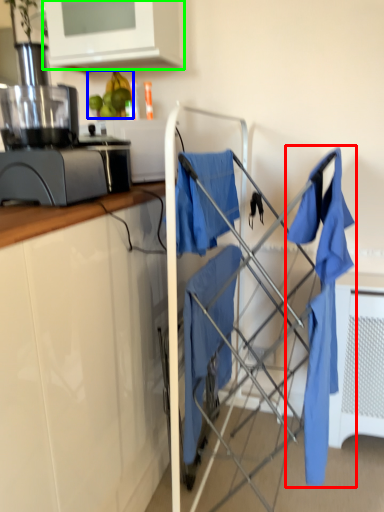
Question: Which object is the farthest from laundry (highlighted by a red box)? Choose among these: fruit (highlighted by a blue box) or cabinetry (highlighted by a green box).

Choices:
 (A) fruit
 (B) cabinetry

Answer: (B)